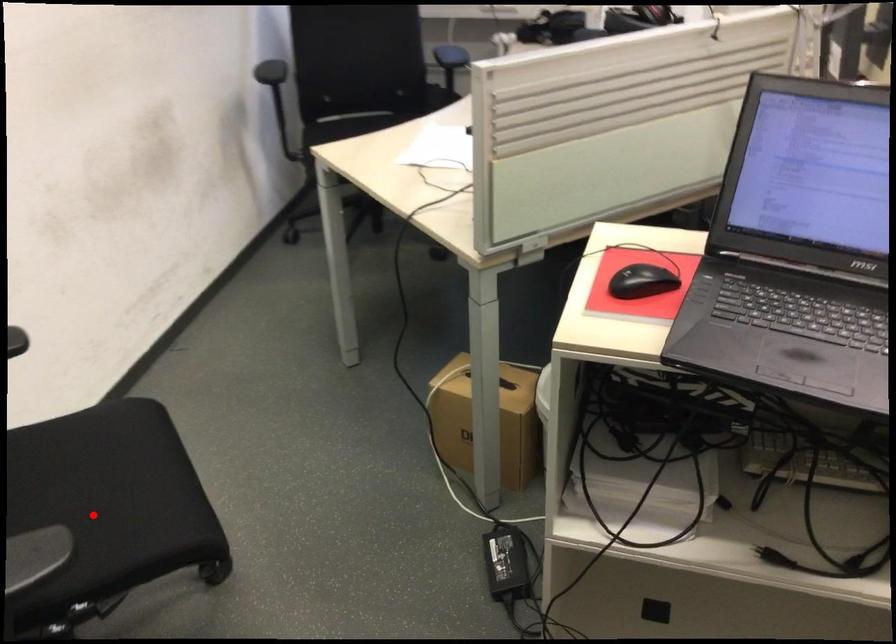
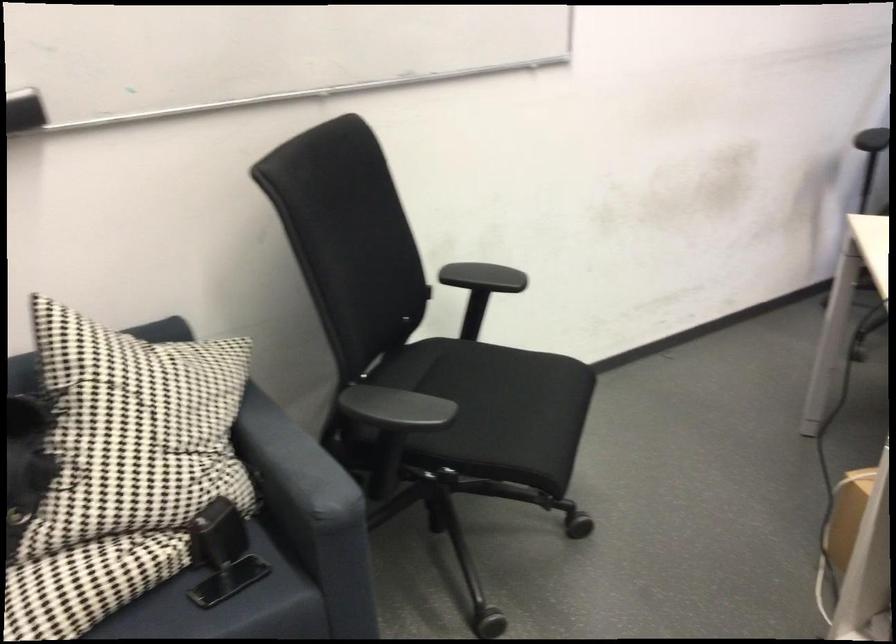
The point at the highlighted location is marked in the first image. Where is the corresponding point in the second image?

(495, 409)